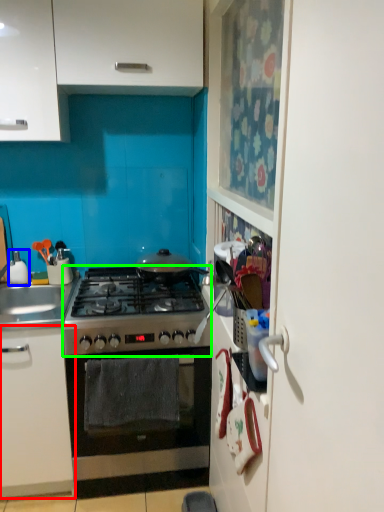
Question: Based on their relative distances, which object is farther from cabinetry (highlighted by a red box)? Choose from appliance (highlighted by a blue box) and gas stove (highlighted by a green box).

Choices:
 (A) appliance
 (B) gas stove

Answer: (A)